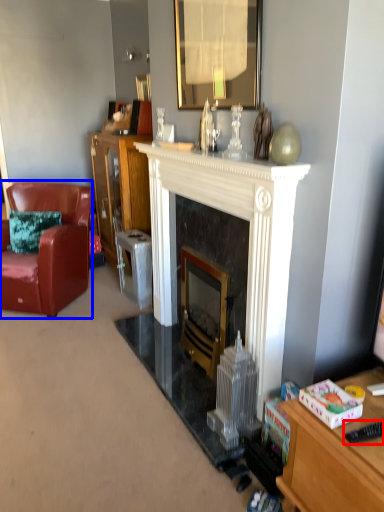
Question: Which point is further to the camera, remote control (highlighted by a red box) or chair (highlighted by a blue box)?

Choices:
 (A) remote control
 (B) chair

Answer: (B)